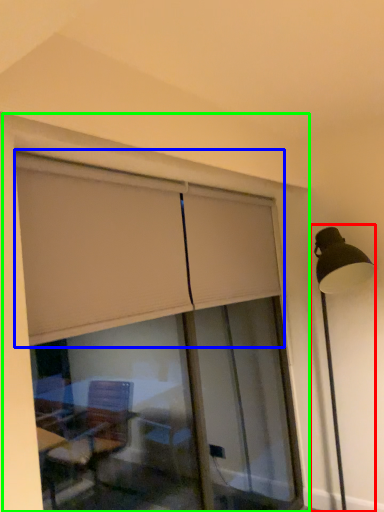
Question: Which object is positioned closest to lamp post (highlighted by a red box)? Select from curtain (highlighted by a blue box) and window frame (highlighted by a green box).

Choices:
 (A) curtain
 (B) window frame

Answer: (B)